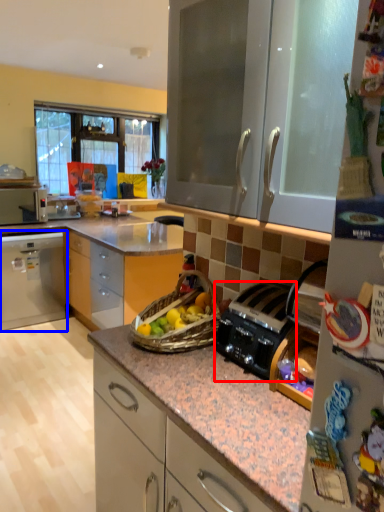
Question: Which of the following is the closest to the observer, kitchen appliance (highlighted by a red box) or cabinetry (highlighted by a blue box)?

Choices:
 (A) kitchen appliance
 (B) cabinetry

Answer: (A)